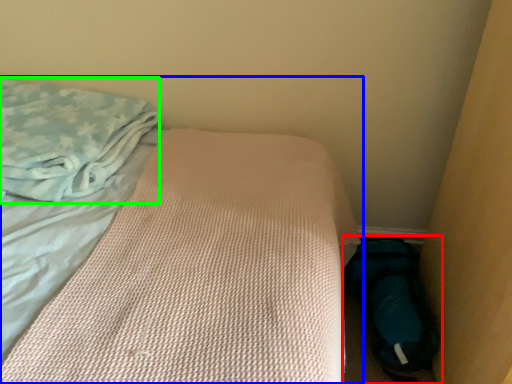
Question: Which object is positioned closest to footwear (highlighted by a red box)? Select from bed (highlighted by a blue box) and cloth (highlighted by a green box).

Choices:
 (A) bed
 (B) cloth

Answer: (A)